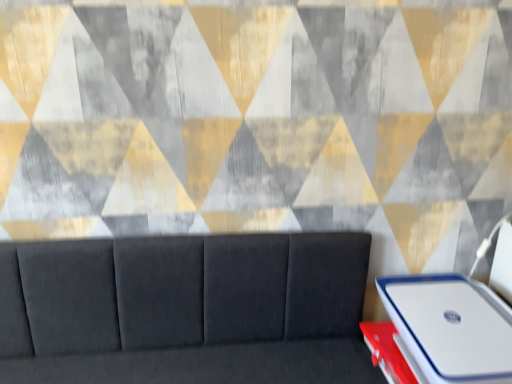
Locate an element on the screen. Image resolution: width=512 pixels, height=384 pixels. white plastic laptop at right is located at coordinates (451, 327).

Image resolution: width=512 pixels, height=384 pixels. What do you see at coordinates (451, 327) in the screenshot?
I see `white plastic laptop at right` at bounding box center [451, 327].

What is the approximate height of white plastic laptop at right?

It is 5.78 inches.

From the picture: What is the approximate width of white plastic laptop at right?

It is 32.47 centimeters.

The width and height of the screenshot is (512, 384). I want to click on white plastic laptop at right, so click(x=451, y=327).